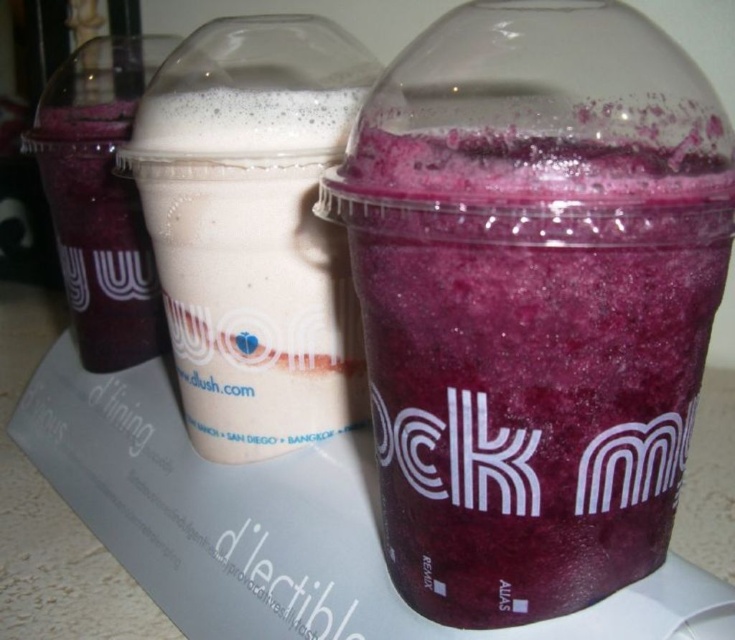
Does purple matte smoothie at right have a lesser width compared to smooth white milkshake at center?

In fact, purple matte smoothie at right might be wider than smooth white milkshake at center.

Locate an element on the screen. The height and width of the screenshot is (640, 735). purple matte smoothie at right is located at coordinates (530, 355).